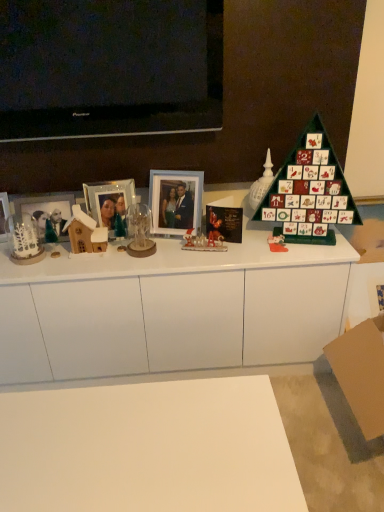
Question: Is brown cardboard at lower right behind green wooden advent calendar at right, which is counted as the 2th toy, starting from the right?

Choices:
 (A) yes
 (B) no

Answer: (B)

Question: From the image's perspective, is brown cardboard at lower right located above green wooden advent calendar at right, placed as the 5th toy when sorted from left to right?

Choices:
 (A) no
 (B) yes

Answer: (A)

Question: Can you confirm if brown cardboard at lower right is bigger than green wooden advent calendar at right, placed as the 5th toy when sorted from left to right?

Choices:
 (A) yes
 (B) no

Answer: (A)

Question: Does brown cardboard at lower right have a greater height compared to green wooden advent calendar at right, which is counted as the 2th toy, starting from the right?

Choices:
 (A) yes
 (B) no

Answer: (A)

Question: From the image's perspective, is brown cardboard at lower right beneath green wooden advent calendar at right, placed as the 5th toy when sorted from left to right?

Choices:
 (A) yes
 (B) no

Answer: (A)

Question: Is brown cardboard at lower right thinner than green wooden advent calendar at right, which is counted as the 2th toy, starting from the right?

Choices:
 (A) no
 (B) yes

Answer: (A)

Question: Is wooden house at left, which appears as the 2th toy when viewed from the left, positioned with its back to white glossy santa claus at center, marked as the fourth toy in a left-to-right arrangement?

Choices:
 (A) yes
 (B) no

Answer: (B)

Question: From the image's perspective, would you say wooden house at left, which appears as the 2th toy when viewed from the left, is shown under white glossy santa claus at center, the 3th toy in the right-to-left sequence?

Choices:
 (A) no
 (B) yes

Answer: (A)

Question: Can you confirm if wooden house at left, which appears as the 5th toy when viewed from the right, is smaller than white glossy santa claus at center, marked as the fourth toy in a left-to-right arrangement?

Choices:
 (A) no
 (B) yes

Answer: (A)

Question: From the image's perspective, is wooden house at left, which appears as the 2th toy when viewed from the left, over white glossy santa claus at center, marked as the fourth toy in a left-to-right arrangement?

Choices:
 (A) yes
 (B) no

Answer: (A)

Question: Is white glossy santa claus at center, the 3th toy in the right-to-left sequence, completely or partially inside wooden house at left, which appears as the 5th toy when viewed from the right?

Choices:
 (A) no
 (B) yes

Answer: (A)

Question: Considering the relative sizes of wooden house at left, which appears as the 5th toy when viewed from the right, and white glossy santa claus at center, the 3th toy in the right-to-left sequence, in the image provided, is wooden house at left, which appears as the 5th toy when viewed from the right, wider than white glossy santa claus at center, the 3th toy in the right-to-left sequence,?

Choices:
 (A) no
 (B) yes

Answer: (B)

Question: Can you confirm if white glossy santa claus at center, marked as the fourth toy in a left-to-right arrangement, is bigger than green matte advent calendar at right?

Choices:
 (A) no
 (B) yes

Answer: (A)